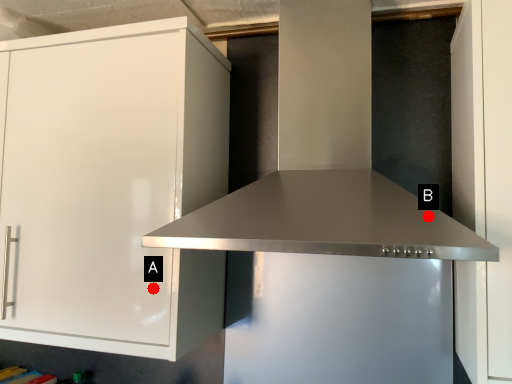
Question: Two points are circled on the image, labeled by A and B beside each circle. Which point is closer to the camera?

Choices:
 (A) A is closer
 (B) B is closer

Answer: (B)